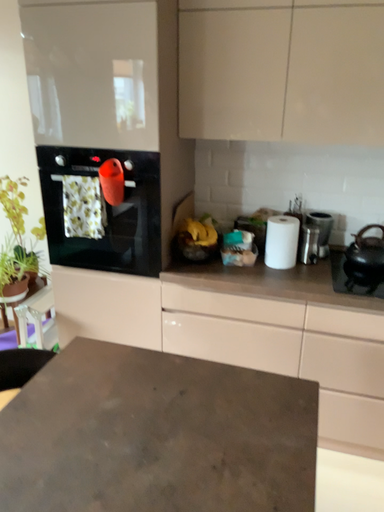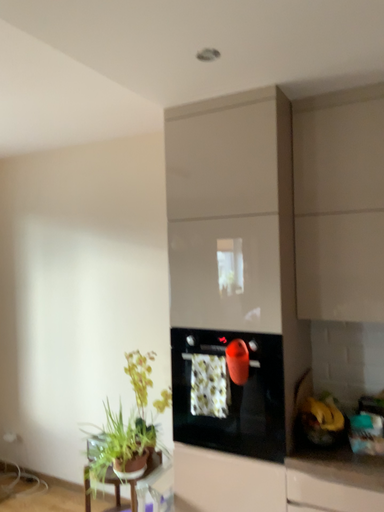
Question: How did the camera likely rotate when shooting the video?

Choices:
 (A) rotated downward
 (B) rotated upward

Answer: (B)